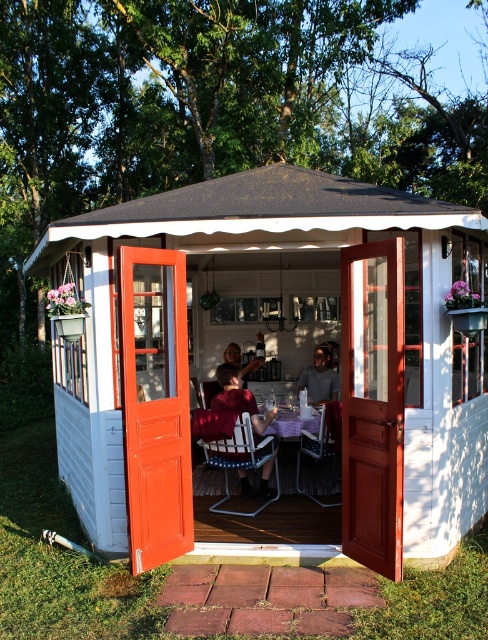
You are standing at the entrance of the white wood gazebo at center. If you walk straight ahead, will you exit the gazebo through one of its sides?

The white wood gazebo at center is located at point (273, 356), so walking straight ahead from the entrance may not necessarily exit through a side, as the gazebo is octagonal and the exit direction depends on the structure.

You are a guest at this outdoor dining area and want to find the matte red shirt at center. Where should you look relative to the matte black shirt at center?

The matte red shirt at center is positioned under the matte black shirt at center, so you should look below the matte black shirt at center to find it.

You are a guest at this outdoor dining area and see two people wearing the matte red shirt at center and the matte black shirt at center. Which person is sitting to the left of the other?

The matte black shirt at center is to the left of the matte red shirt at center because the matte red shirt at center is positioned to the right of the matte black shirt at center.